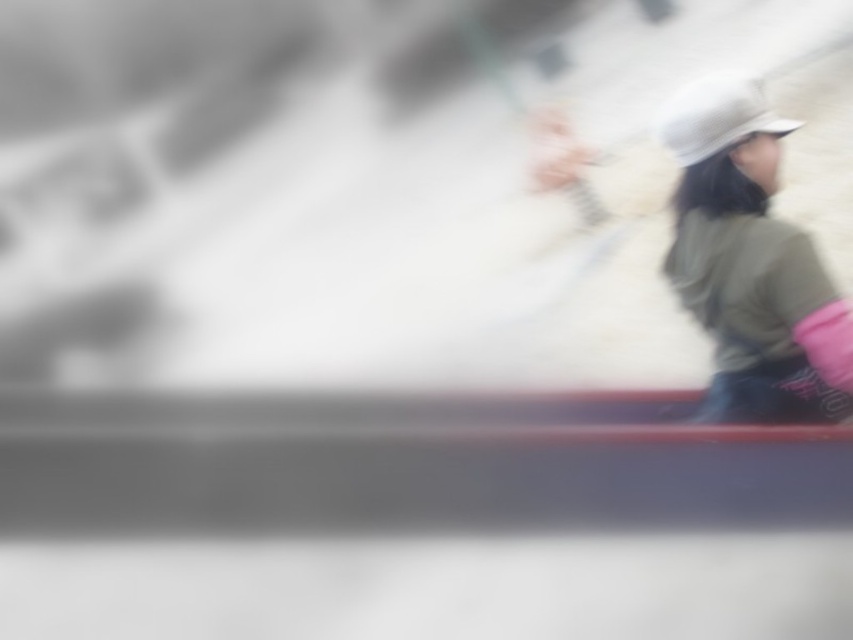
You are a photographer trying to capture a clear shot of the khaki cotton hat at right and the white matte hat at upper right. Since the image is blurry, you want to adjust your focus. Which hat should you focus on to ensure it appears sharp in the final photo?

The khaki cotton hat at right is below the white matte hat at upper right, so focusing on the white matte hat at upper right would ensure it appears sharp as it is positioned higher in the frame.

You are navigating a boat in a foggy lake and see two points of light ahead. The points are labeled as point (781, 371) and point (741, 108). According to the image, which point is closer to your boat?

Point (741, 108) is closer to your boat because it is in front of point (781, 371), which is behind it.